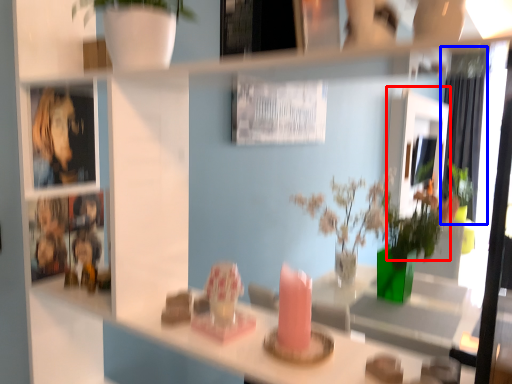
Question: Which object appears farthest to the camera in this image, mirror (highlighted by a red box) or curtain (highlighted by a blue box)?

Choices:
 (A) mirror
 (B) curtain

Answer: (B)